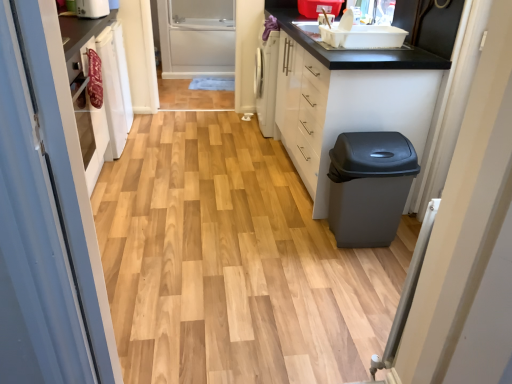
Question: Is white plastic toaster at upper left to the left or to the right of matte gray trash can at right in the image?

Choices:
 (A) left
 (B) right

Answer: (A)

Question: In terms of width, does white plastic toaster at upper left look wider or thinner when compared to matte gray trash can at right?

Choices:
 (A) wide
 (B) thin

Answer: (B)

Question: Which object is the farthest from the clear glass screen door at center?

Choices:
 (A) white glossy cabinet at right
 (B) white plastic toaster at upper left
 (C) matte gray trash can at right
 (D) wooden floor at center

Answer: (C)

Question: Which object is positioned closest to the white plastic toaster at upper left?

Choices:
 (A) matte gray trash can at right
 (B) wooden floor at center
 (C) white glossy cabinet at right
 (D) clear glass screen door at center

Answer: (C)